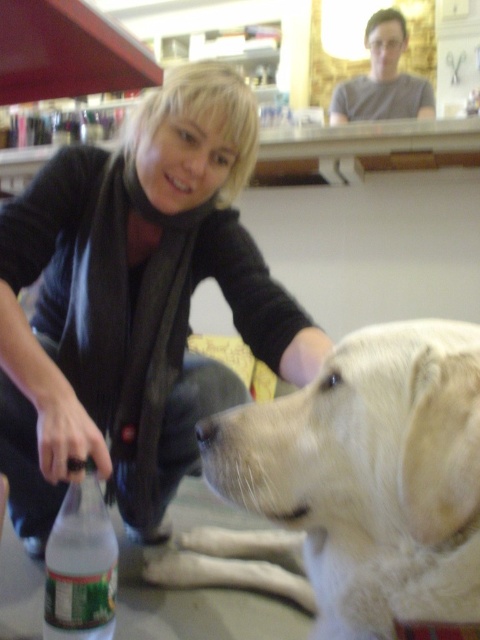
Question: Is the position of black sweater at center less distant than that of white fur dog at lower center?

Choices:
 (A) no
 (B) yes

Answer: (A)

Question: Which of the following is the farthest from the observer?

Choices:
 (A) (63, 528)
 (B) (107, 228)

Answer: (B)

Question: Which of these objects is positioned closest to the green plastic bottle at lower left?

Choices:
 (A) white fur dog at lower center
 (B) black sweater at center

Answer: (B)

Question: Based on their relative distances, which object is farther from the white fur dog at lower center?

Choices:
 (A) black sweater at center
 (B) green plastic bottle at lower left

Answer: (A)

Question: Is black sweater at center further to camera compared to green plastic bottle at lower left?

Choices:
 (A) yes
 (B) no

Answer: (B)

Question: Is white fur dog at lower center smaller than green plastic bottle at lower left?

Choices:
 (A) yes
 (B) no

Answer: (B)